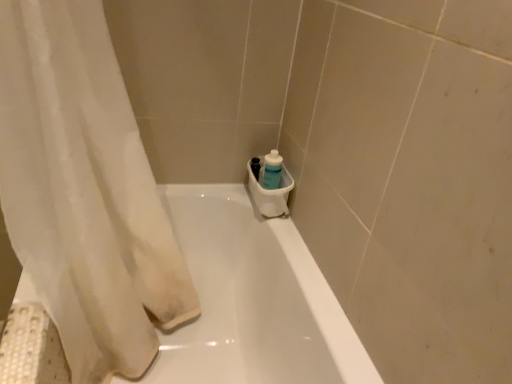
Find the location of a particular element. free location in front of translucent plastic bottle at lower right is located at coordinates tap(274, 235).